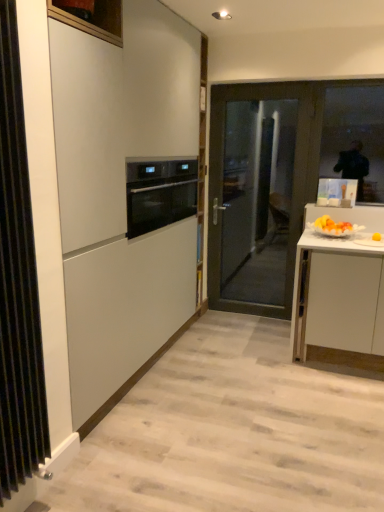
I want to click on matte white cabinet at center, so click(124, 197).

Describe the element at coordinates (18, 285) in the screenshot. I see `black metal radiator at left` at that location.

This screenshot has width=384, height=512. In order to click on matte white cabinet at center in this screenshot , I will do `click(124, 197)`.

In terms of size, does transparent glass window at upper right appear bigger or smaller than matte white cabinet at center?

transparent glass window at upper right is smaller than matte white cabinet at center.

Considering the relative positions of transparent glass window at upper right and matte white cabinet at center in the image provided, is transparent glass window at upper right to the left of matte white cabinet at center from the viewer's perspective?

In fact, transparent glass window at upper right is to the right of matte white cabinet at center.

From the image's perspective, relative to matte white cabinet at center, is transparent glass window at upper right above or below?

Clearly, from the image's perspective, transparent glass window at upper right is above matte white cabinet at center.

Could you tell me if transparent glass window at upper right is turned towards matte white cabinet at center?

No, transparent glass window at upper right is not facing towards matte white cabinet at center.

Is point (7, 184) farther from viewer compared to point (263, 90)?

No.

Is black metal radiator at left to the right of dark gray glass door at center from the viewer's perspective?

No, black metal radiator at left is not to the right of dark gray glass door at center.

At what (x,y) coordinates should I click in order to perform the action: click on radiator below the dark gray glass door at center (from the image's perspective). Please return your answer as a coordinate pair (x, y). The image size is (384, 512). Looking at the image, I should click on (18, 285).

From a real-world perspective, relative to dark gray glass door at center, is black metal radiator at left vertically above or below?

black metal radiator at left is situated higher than dark gray glass door at center in the real world.

Is transparent glass window at upper right oriented towards dark gray glass door at center?

No, transparent glass window at upper right is not facing towards dark gray glass door at center.

Does transparent glass window at upper right have a smaller size compared to dark gray glass door at center?

Correct, transparent glass window at upper right occupies less space than dark gray glass door at center.

From the picture: Which of these two, transparent glass window at upper right or dark gray glass door at center, stands shorter?

Standing shorter between the two is transparent glass window at upper right.

Which object is positioned more to the right, transparent glass window at upper right or dark gray glass door at center?

transparent glass window at upper right is more to the right.

Visually, is black metal radiator at left positioned to the left or to the right of transparent glass window at upper right?

Clearly, black metal radiator at left is on the left of transparent glass window at upper right in the image.

From a real-world perspective, is black metal radiator at left above or below transparent glass window at upper right?

black metal radiator at left is situated lower than transparent glass window at upper right in the real world.

Does black metal radiator at left have a larger size compared to transparent glass window at upper right?

Yes, black metal radiator at left is bigger than transparent glass window at upper right.

Does point (30, 271) come behind point (380, 106)?

No, (30, 271) is closer to viewer.

Does matte white cabinet at center turn towards black metal radiator at left?

No, matte white cabinet at center is not turned towards black metal radiator at left.

Locate an element on the screen. The height and width of the screenshot is (512, 384). radiator that appears on the left of matte white cabinet at center is located at coordinates (18, 285).

Is matte white cabinet at center directly adjacent to black metal radiator at left?

No, matte white cabinet at center is not next to black metal radiator at left.

Would you consider black metal radiator at left to be distant from black glass oven at center?

Indeed, black metal radiator at left is not near black glass oven at center.

Does point (11, 484) come in front of point (176, 186)?

Yes, it is.

What's the angular difference between black metal radiator at left and black glass oven at center's facing directions?

The facing directions of black metal radiator at left and black glass oven at center are 0.39 degrees apart.

Who is shorter, black metal radiator at left or black glass oven at center?

With less height is black glass oven at center.

Is transparent glass window at upper right inside dark gray glass door at center?

Definitely not — transparent glass window at upper right is not inside dark gray glass door at center.

Could you tell me if dark gray glass door at center is facing transparent glass window at upper right?

No, dark gray glass door at center is not facing towards transparent glass window at upper right.

How many degrees apart are the facing directions of dark gray glass door at center and transparent glass window at upper right?

dark gray glass door at center and transparent glass window at upper right are facing 0.755 degrees away from each other.

At what (x,y) coordinates should I click in order to perform the action: click on cabinetry below the transparent glass window at upper right (from the image's perspective). Please return your answer as a coordinate pair (x, y). This screenshot has width=384, height=512. Looking at the image, I should click on pyautogui.click(x=124, y=197).

I want to click on door on the right of black metal radiator at left, so click(x=260, y=191).

From the image, which object appears to be farther from black glass oven at center, dark gray glass door at center or matte white cabinet at center?

dark gray glass door at center is further to black glass oven at center.

Looking at the image, which one is located closer to black glass oven at center, black metal radiator at left or matte white cabinet at center?

matte white cabinet at center is positioned closer to the anchor black glass oven at center.

Based on their spatial positions, is dark gray glass door at center or black glass oven at center further from matte white cabinet at center?

The object further to matte white cabinet at center is dark gray glass door at center.

Which object lies nearer to the anchor point black metal radiator at left, dark gray glass door at center or transparent glass window at upper right?

dark gray glass door at center.

Considering their positions, is transparent glass window at upper right positioned further to matte white cabinet at center than dark gray glass door at center?

The object further to matte white cabinet at center is transparent glass window at upper right.

When comparing their distances from dark gray glass door at center, does black metal radiator at left or black glass oven at center seem further?

The object further to dark gray glass door at center is black metal radiator at left.

Estimate the real-world distances between objects in this image. Which object is closer to dark gray glass door at center, black metal radiator at left or matte white cabinet at center?

The object closer to dark gray glass door at center is matte white cabinet at center.

Based on their spatial positions, is black metal radiator at left or dark gray glass door at center closer to transparent glass window at upper right?

The object closer to transparent glass window at upper right is dark gray glass door at center.

Where is `kitchen appliance located between matte white cabinet at center and transparent glass window at upper right in the left-right direction`? kitchen appliance located between matte white cabinet at center and transparent glass window at upper right in the left-right direction is located at coordinates (159, 193).

You are a GUI agent. You are given a task and a screenshot of the screen. Output one action in this format:
    pyautogui.click(x=<x>, y=<y>)
    Task: Click on the cabinetry between black metal radiator at left and black glass oven at center in the front-back direction
    The height and width of the screenshot is (512, 384).
    Given the screenshot: What is the action you would take?
    pyautogui.click(x=124, y=197)

The image size is (384, 512). Find the location of `cabinetry between black metal radiator at left and dark gray glass door at center from front to back`. cabinetry between black metal radiator at left and dark gray glass door at center from front to back is located at coordinates (124, 197).

You are a GUI agent. You are given a task and a screenshot of the screen. Output one action in this format:
    pyautogui.click(x=<x>, y=<y>)
    Task: Click on the kitchen appliance located between black metal radiator at left and transparent glass window at upper right in the depth direction
    
    Given the screenshot: What is the action you would take?
    pyautogui.click(x=159, y=193)